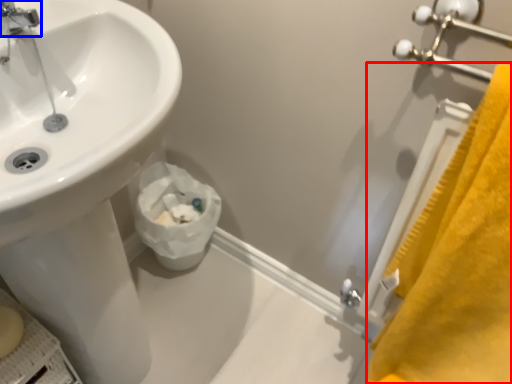
Question: Which object is closer to the camera taking this photo, bath towel (highlighted by a red box) or tap (highlighted by a blue box)?

Choices:
 (A) bath towel
 (B) tap

Answer: (A)